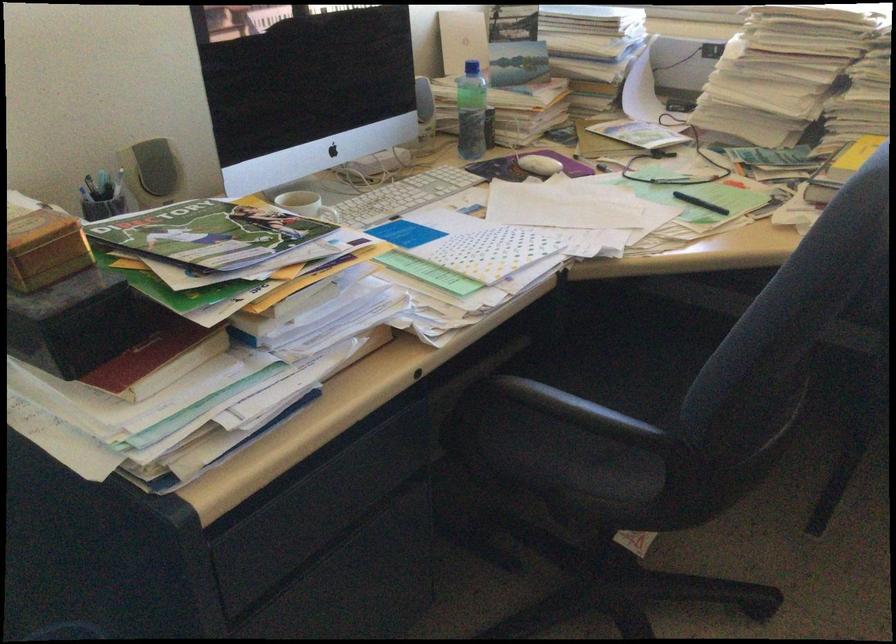
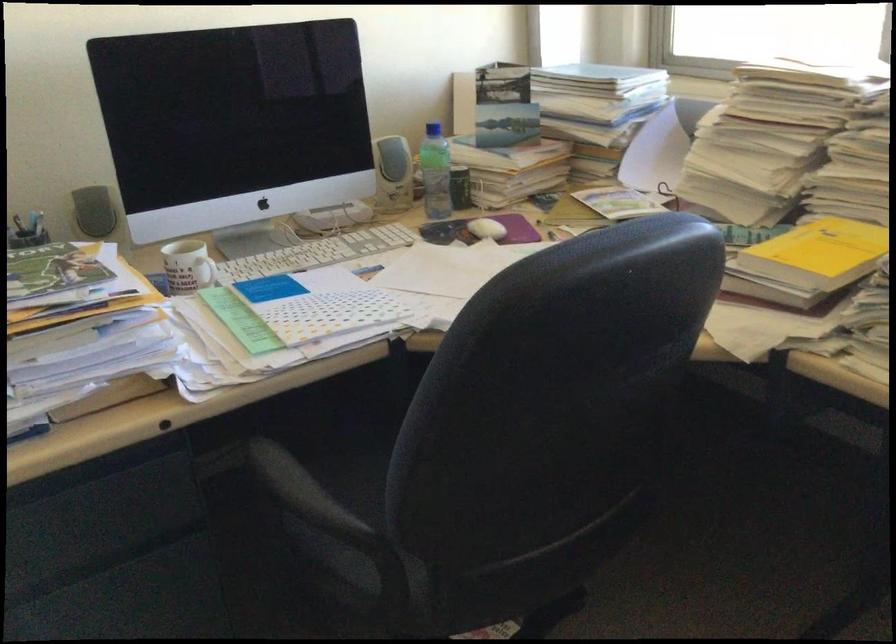
Where in the second image is the point corresponding to (549,163) from the first image?

(487, 229)